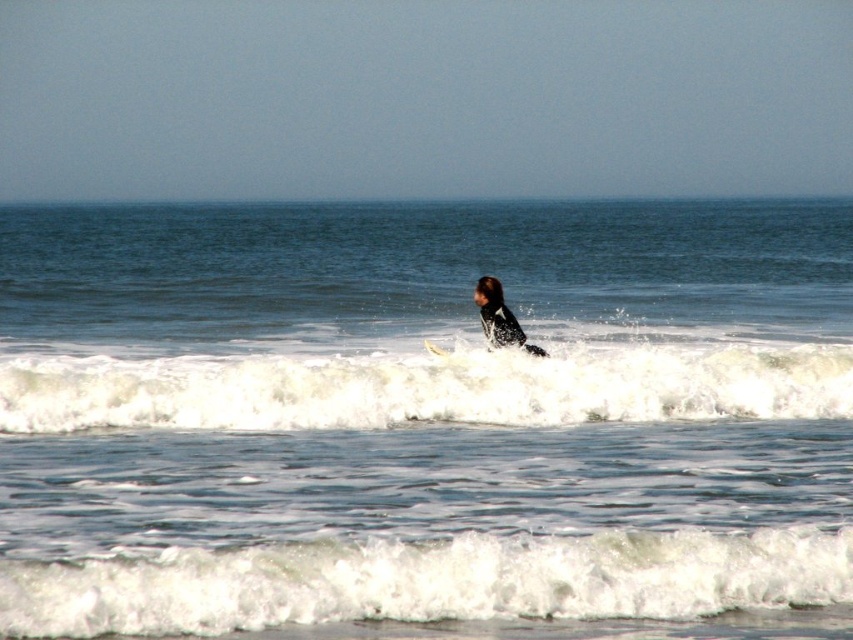
You are a photographer standing at the camera position. You want to focus on the point that is closer to you. Which point should you choose between point (741, 413) and point (447, 349)?

Point (741, 413) is closer to the camera than point (447, 349), so you should choose point (741, 413) to focus on.

You are a photographer trying to capture the surfer in the image. Since the blue water at center and the black wetsuit at center are both in the frame, which one appears wider?

The blue water at center appears wider because its width surpasses that of the black wetsuit at center.

You are a photographer trying to capture the surfer in the image. You want to ensure the black wetsuit at center and the white foam surfboard at center are both clearly visible in your shot. Based on their positions, which one is positioned higher in the frame?

The black wetsuit at center is above the white foam surfboard at center, so it is positioned higher in the frame.